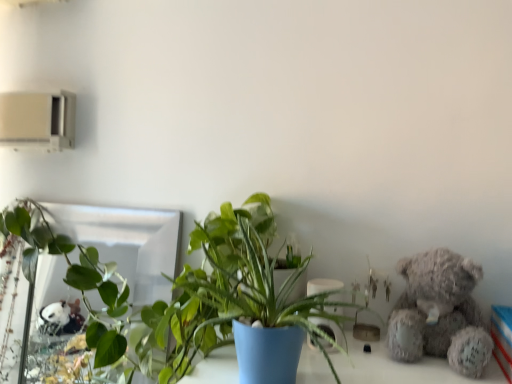
Question: Does point (437, 294) appear closer or farther from the camera than point (29, 200)?

Choices:
 (A) farther
 (B) closer

Answer: (B)

Question: From the image's perspective, is fuzzy gray teddy bear at right located above or below blue matte pot at center?

Choices:
 (A) above
 (B) below

Answer: (B)

Question: Which of these objects is positioned closest to the fuzzy gray teddy bear at right?

Choices:
 (A) blue matte pot at center
 (B) silver reflective mirror at upper left

Answer: (A)

Question: Which is farther from the blue matte pot at center?

Choices:
 (A) silver reflective mirror at upper left
 (B) fuzzy gray teddy bear at right

Answer: (B)